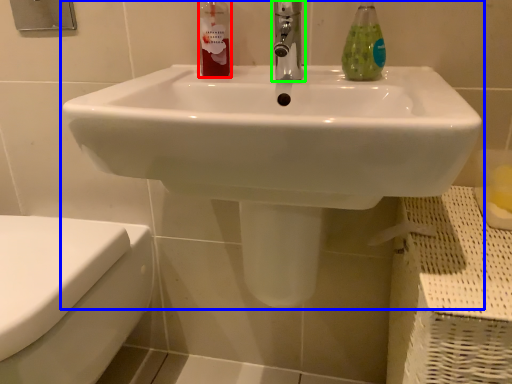
Question: Which object is positioned closest to cleaning product (highlighted by a red box)? Select from sink (highlighted by a blue box) and tap (highlighted by a green box).

Choices:
 (A) sink
 (B) tap

Answer: (B)